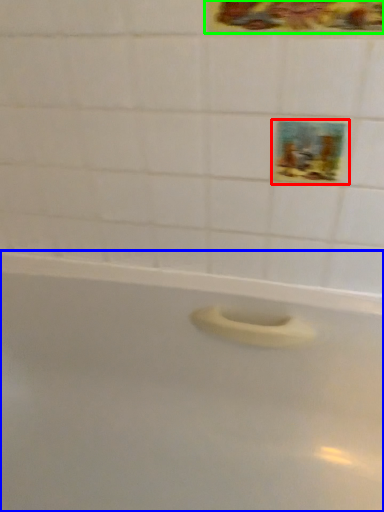
Question: Which object is positioned farthest from decorative picture (highlighted by a red box)? Select from bathtub (highlighted by a blue box) and decorative picture (highlighted by a green box).

Choices:
 (A) bathtub
 (B) decorative picture

Answer: (A)